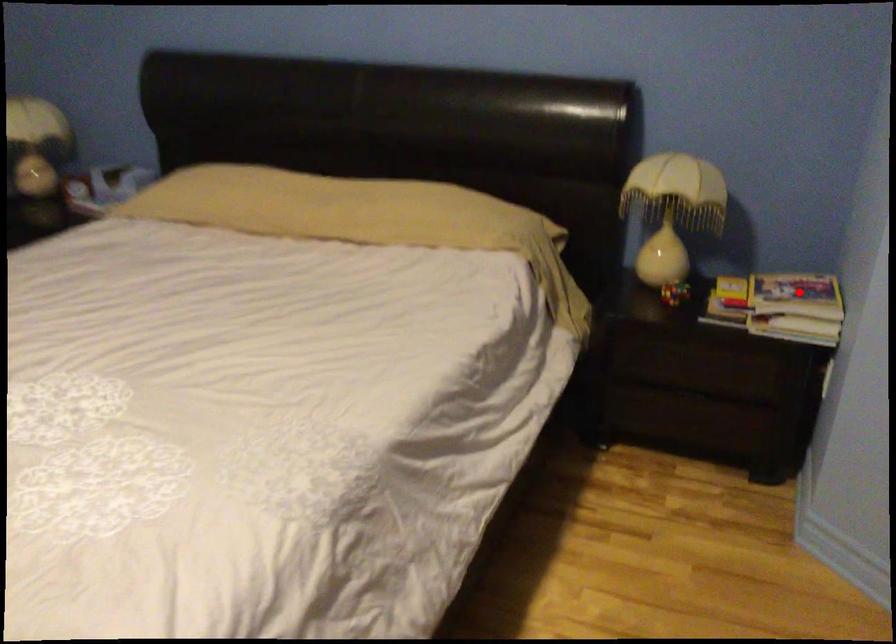
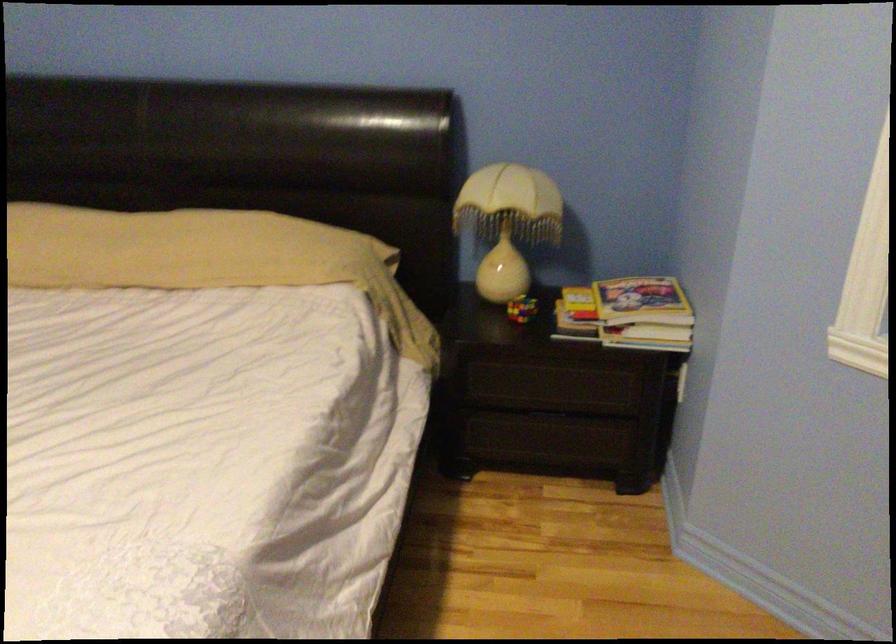
Locate, in the second image, the point that corresponds to the highlighted location in the first image.

(642, 301)